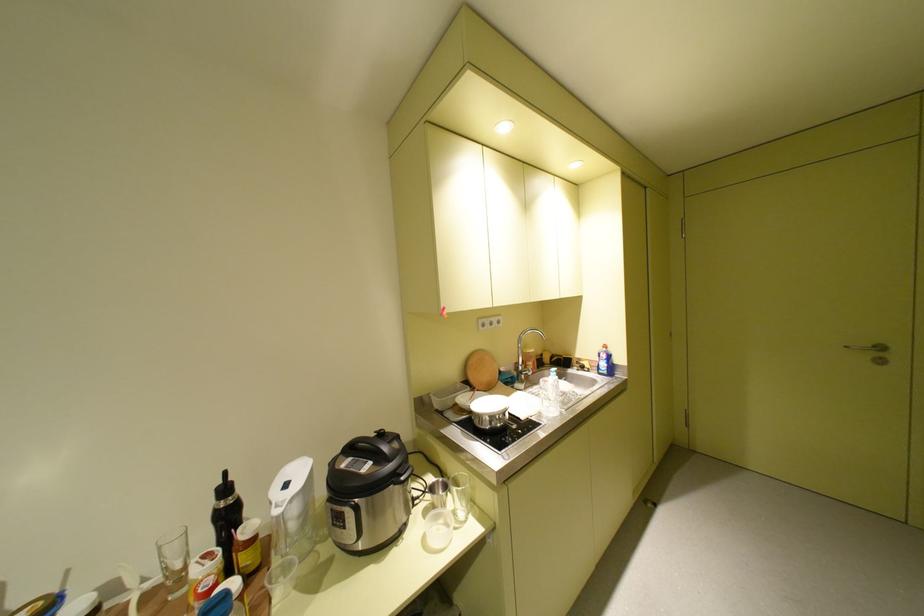
Find where to lift the clear water bottle. Please return your answer as a coordinate pair (x, y).

(550, 394)